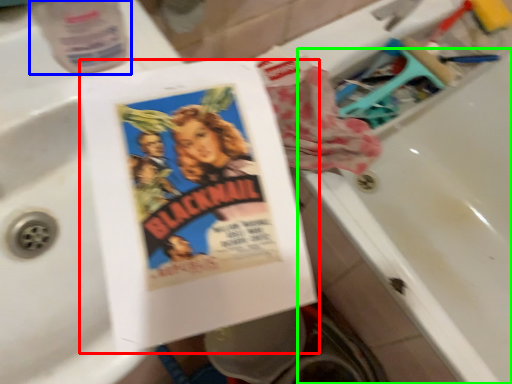
Question: Which object is positioned closest to paperback book (highlighted by a red box)? Select from bottle (highlighted by a blue box) and bath (highlighted by a green box).

Choices:
 (A) bottle
 (B) bath

Answer: (A)